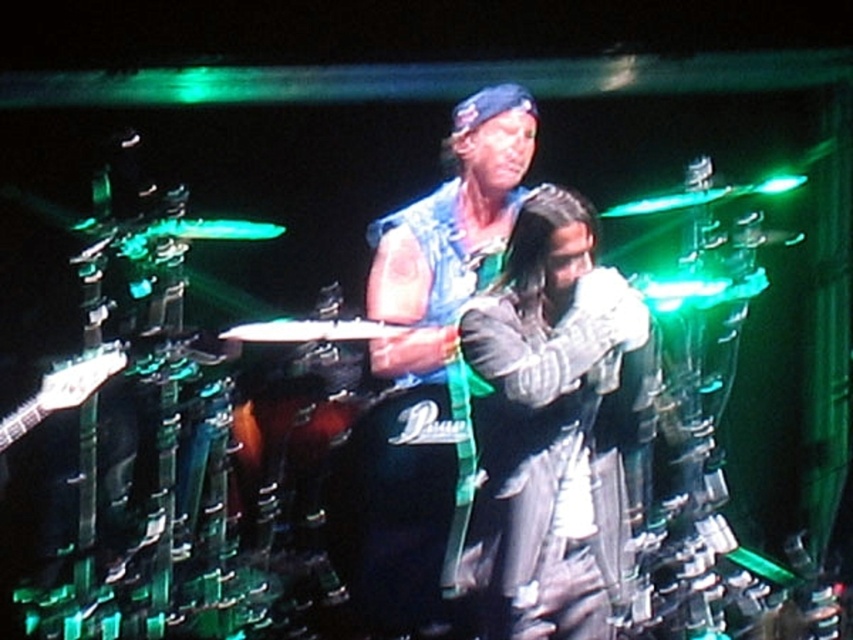
You are a photographer at the concert and want to capture a photo of both the leather jacket at center and the denim vest at center in the same frame. Which one should you focus on first if you want to ensure both are in focus?

The leather jacket at center is to the right of denim vest at center. Since they are both at center, focusing on either one should keep both in focus as they are positioned closely together.

You are standing at the front of the stage during the concert. You notice a point at coordinates (546, 417). What object is located at that point?

The point at coordinates (546, 417) corresponds to the leather jacket at center.

Looking at this image, you are a photographer at the concert and need to capture a closeup of the singer holding the microphone while also including the drummer in the background. Given the leather jacket at center is positioned at coordinates point 0.653, 0.641, can you frame the shot so both the singer and drummer are visible?

The leather jacket at center is located at point (546, 417), which suggests it is centrally placed in the image. By focusing on the singer at the foreground and using a wide enough lens, the drummer in the background can also be included in the frame.